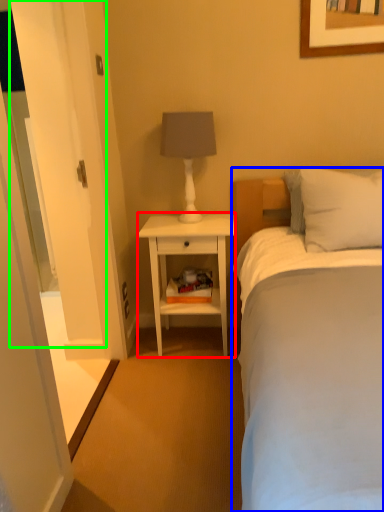
Question: Which object is the closest to the nightstand (highlighted by a red box)? Choose among these: bed (highlighted by a blue box) or glass door (highlighted by a green box).

Choices:
 (A) bed
 (B) glass door

Answer: (B)